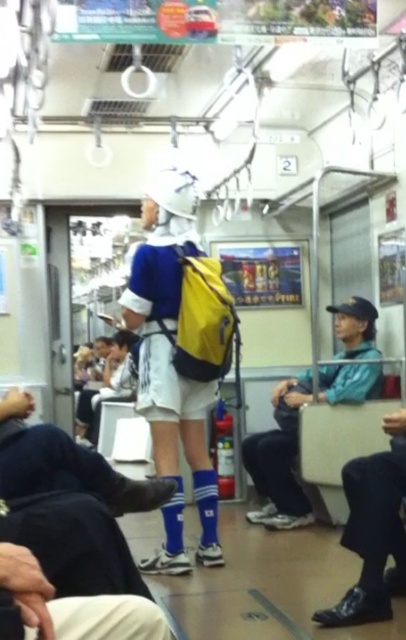
Question: Among these objects, which one is nearest to the camera?

Choices:
 (A) teal matte jacket at center
 (B) matte blue jersey at center

Answer: (B)

Question: Which point appears closest to the camera in this image?

Choices:
 (A) (179, 484)
 (B) (347, 365)

Answer: (A)

Question: Can you confirm if matte blue jersey at center is wider than teal matte jacket at center?

Choices:
 (A) no
 (B) yes

Answer: (A)

Question: Among these points, which one is nearest to the camera?

Choices:
 (A) (170, 394)
 (B) (269, 508)

Answer: (A)

Question: Can you confirm if matte blue jersey at center is positioned to the left of teal matte jacket at center?

Choices:
 (A) no
 (B) yes

Answer: (B)

Question: Is matte blue jersey at center thinner than teal matte jacket at center?

Choices:
 (A) no
 (B) yes

Answer: (B)